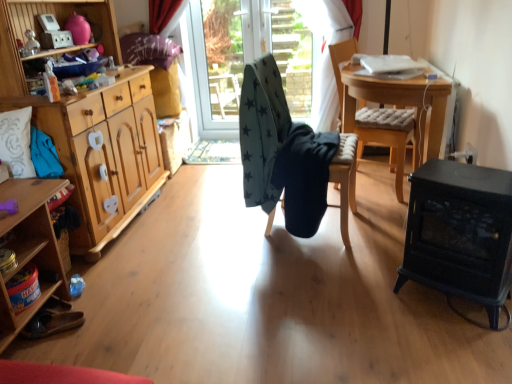
Where is `vacant space that is in between teal star-patterned fabric at center, which ranks as the first chair in left-to-right order, and brown leather shoes at lower left`? This screenshot has height=384, width=512. vacant space that is in between teal star-patterned fabric at center, which ranks as the first chair in left-to-right order, and brown leather shoes at lower left is located at coordinates (198, 268).